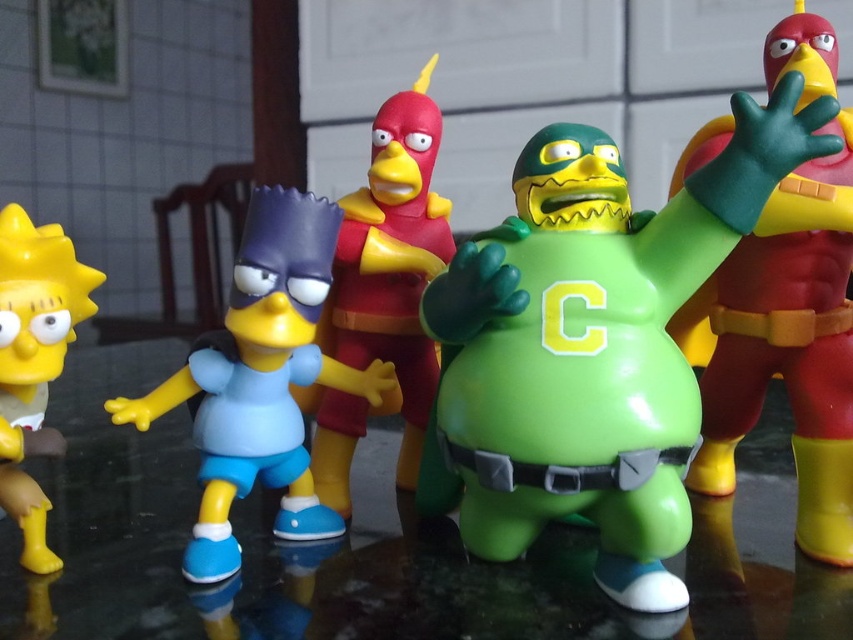
Looking at this image, does green matte figure at center appear under shiny red plastic bird at center?

Correct, green matte figure at center is located below shiny red plastic bird at center.

Is green matte figure at center wider than shiny red plastic bird at center?

Indeed, green matte figure at center has a greater width compared to shiny red plastic bird at center.

Between point (471, 394) and point (328, 328), which one is positioned in front?

Point (471, 394) is in front.

Where is `green matte figure at center`? green matte figure at center is located at coordinates (602, 348).

Does green matte figure at center have a larger size compared to shiny red and yellow figure at center right?

Yes.

Which is more to the right, green matte figure at center or shiny red and yellow figure at center right?

shiny red and yellow figure at center right

Image resolution: width=853 pixels, height=640 pixels. Describe the element at coordinates (602, 348) in the screenshot. I see `green matte figure at center` at that location.

Image resolution: width=853 pixels, height=640 pixels. Find the location of `green matte figure at center`. green matte figure at center is located at coordinates (602, 348).

Does point (515, 172) lie in front of point (550, 316)?

That is False.

Is green matte figure at center smaller than yellow fabric letter c at center?

Incorrect, green matte figure at center is not smaller in size than yellow fabric letter c at center.

Does point (637, 230) lie behind point (567, 291)?

That is True.

The width and height of the screenshot is (853, 640). I want to click on green matte figure at center, so click(x=602, y=348).